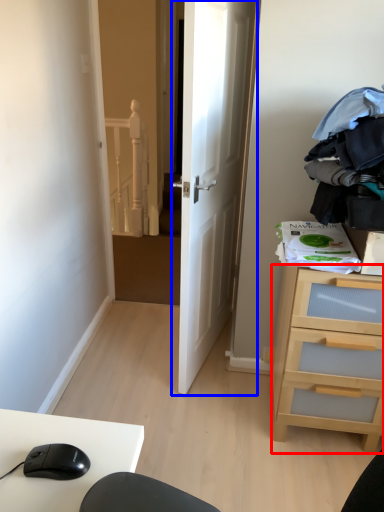
Question: Which object appears farthest to the camera in this image, chest of drawers (highlighted by a red box) or door (highlighted by a blue box)?

Choices:
 (A) chest of drawers
 (B) door

Answer: (A)